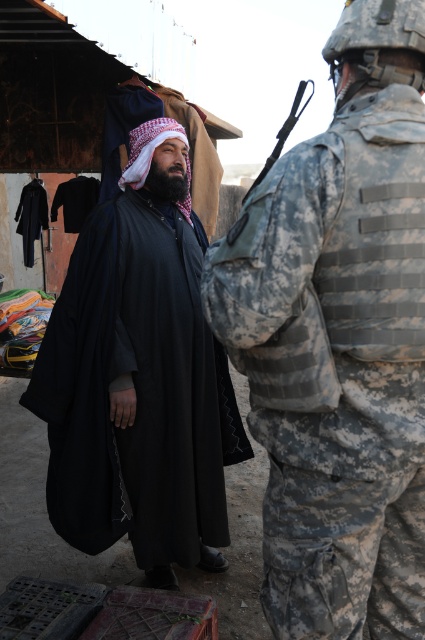
You are a photographer trying to capture both the camouflage uniform at right and the black matte robe at center in the same frame. Which of the two should you adjust your camera angle to focus on first to ensure both are fully visible?

Since the camouflage uniform at right is shorter than the black matte robe at center, you should focus on the black matte robe at center first to ensure its full height is captured, then adjust to include the shorter camouflage uniform at right.

You are a customer at the market and want to approach both the camouflage uniform at right and the black matte robe at center. Which one should you walk towards first if you want to reach the one closer to you?

You should first walk towards the camouflage uniform at right because it is closer to the viewer than the black matte robe at center.